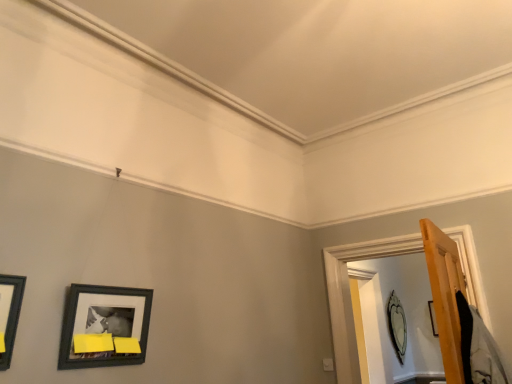
Question: Is wooden door frame at right bigger or smaller than matte black picture frame at upper right, positioned as the 1th picture frame in back-to-front order?

Choices:
 (A) small
 (B) big

Answer: (B)

Question: Considering their positions, is wooden door frame at right located in front of or behind matte black picture frame at upper right, the second picture frame positioned from the top?

Choices:
 (A) behind
 (B) front

Answer: (B)

Question: Which object is the farthest from the matte black picture frame at upper right, which is counted as the second picture frame, starting from the left?

Choices:
 (A) matte black picture frame at lower left, which is the first picture frame in top-to-bottom order
 (B) wooden door frame at right

Answer: (A)

Question: Considering the real-world distances, which object is closest to the matte black picture frame at upper right, which is counted as the 1th picture frame, starting from the bottom?

Choices:
 (A) wooden door frame at right
 (B) matte black picture frame at lower left, placed as the 2th picture frame when sorted from back to front

Answer: (A)